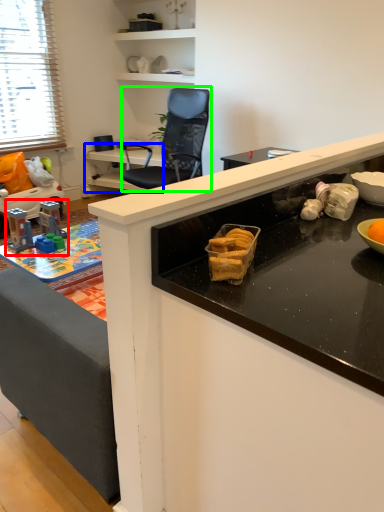
Question: Which object is positioned closest to toy (highlighted by a red box)? Select from table (highlighted by a blue box) and chair (highlighted by a green box).

Choices:
 (A) table
 (B) chair

Answer: (B)